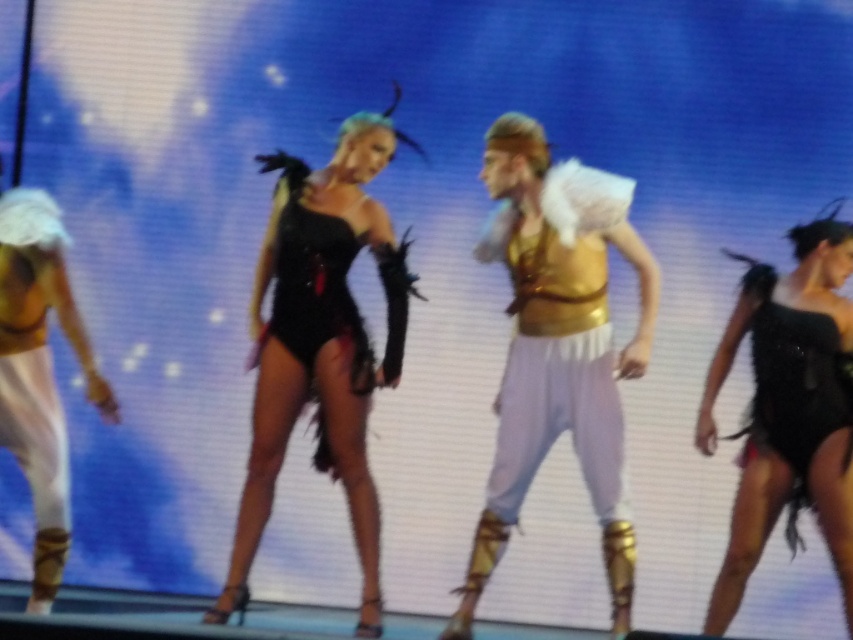
Question: Does black sequined bodysuit at center lie behind shiny black dress at right?

Choices:
 (A) no
 (B) yes

Answer: (B)

Question: Observing the image, what is the correct spatial positioning of black sequined bodysuit at center in reference to matte gold bikini top at left?

Choices:
 (A) left
 (B) right

Answer: (B)

Question: Which object is the farthest from the gold metallic vest at center?

Choices:
 (A) black sequined bodysuit at center
 (B) shiny black dress at right
 (C) matte gold bikini top at left

Answer: (C)

Question: Which point is farther from the camera taking this photo?

Choices:
 (A) (509, 273)
 (B) (805, 310)
 (C) (62, 452)
 (D) (381, 148)

Answer: (D)

Question: Which point is closer to the camera taking this photo?

Choices:
 (A) (265, 400)
 (B) (527, 189)

Answer: (B)

Question: Is gold metallic vest at center below matte gold bikini top at left?

Choices:
 (A) no
 (B) yes

Answer: (A)